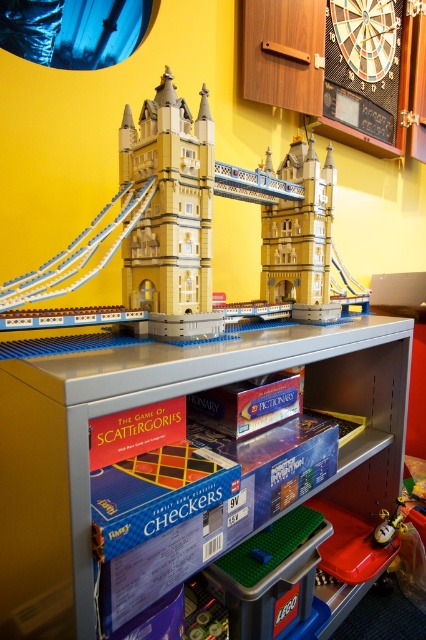
Question: Among these objects, which one is farthest from the camera?

Choices:
 (A) yellow matte lego bridge at center
 (B) metallic gray shelf at center

Answer: (A)

Question: Is metallic gray shelf at center below yellow matte lego bridge at center?

Choices:
 (A) no
 (B) yes

Answer: (B)

Question: Which of the following is the farthest from the observer?

Choices:
 (A) metallic gray shelf at center
 (B) yellow matte lego bridge at center

Answer: (B)

Question: Is metallic gray shelf at center closer to the viewer compared to yellow matte lego bridge at center?

Choices:
 (A) yes
 (B) no

Answer: (A)

Question: Is metallic gray shelf at center smaller than yellow matte lego bridge at center?

Choices:
 (A) no
 (B) yes

Answer: (A)